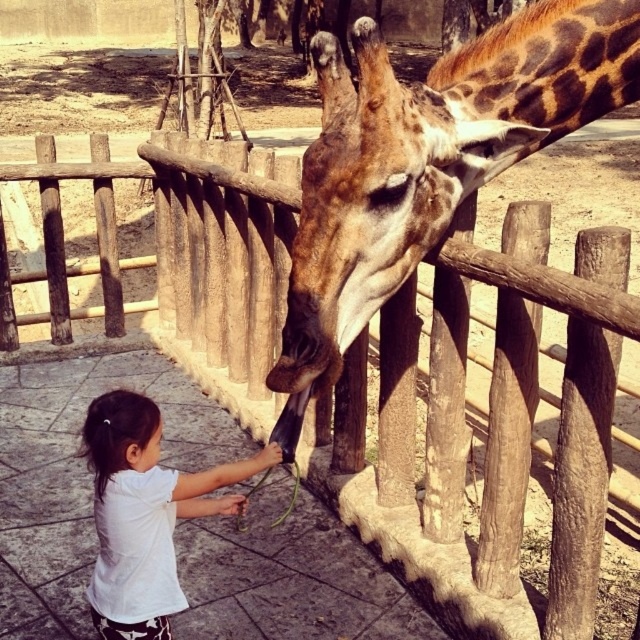
You are a zookeeper trying to place a new feeding station for the spotted brown giraffe at center. The feeding station must be placed at coordinates that are within 0.1 units of its current position. What are the acceptable coordinates for the feeding station?

The spotted brown giraffe at center is located at point (429, 156). The acceptable coordinates for the feeding station must be within 0.1 units of this point. So, the x coordinate should be between 0.144 and 0.344, and the y coordinate should be between 0.573 and 0.773.

You are a zookeeper observing the scene. The spotted brown giraffe at center and the white cotton shirt at lower left are both visible. Which object is wider?

The spotted brown giraffe at center is wider than the white cotton shirt at lower left.

Consider the image. You are a zookeeper observing the scene. The spotted brown giraffe at center and the white cotton shirt at lower left are in your view. Which object is positioned higher in the image?

The spotted brown giraffe at center is above the white cotton shirt at lower left, so the giraffe is higher in the image.